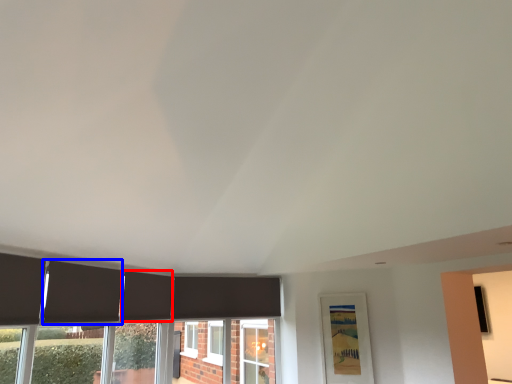
Question: Which object is closer to the camera taking this photo, curtain (highlighted by a red box) or curtain (highlighted by a blue box)?

Choices:
 (A) curtain
 (B) curtain

Answer: (B)